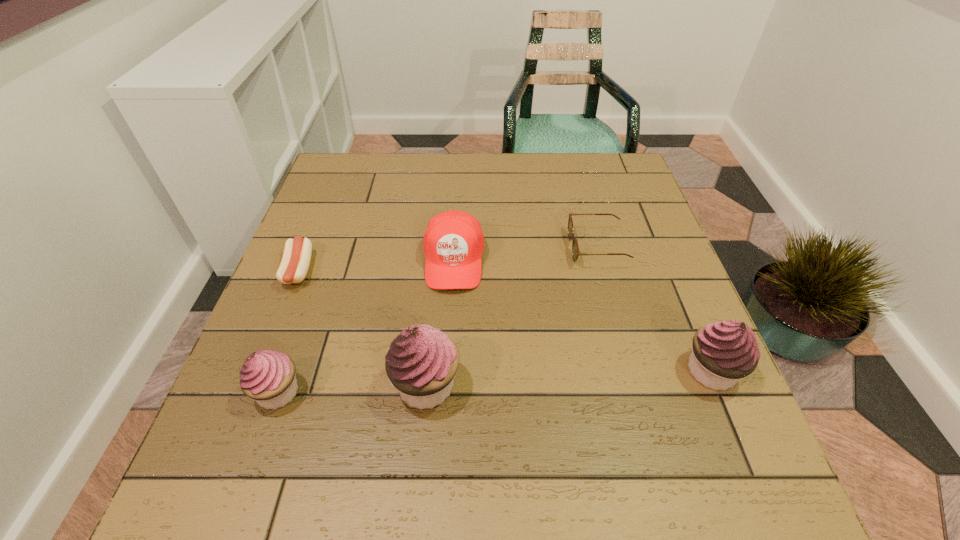
You are a GUI agent. You are given a task and a screenshot of the screen. Output one action in this format:
    pyautogui.click(x=<x>, y=<y>)
    Task: Click on the cupcake identified as the second closest to the second shortest cupcake
    
    Given the screenshot: What is the action you would take?
    pyautogui.click(x=268, y=376)

Find the location of a particular element. The height and width of the screenshot is (540, 960). free region that satisfies the following two spatial constraints: 1. at the front view of the rightmost object; 2. on the right side of the fifth object from left to right is located at coordinates (631, 371).

I want to click on free space in the image that satisfies the following two spatial constraints: 1. on the front side of the leftmost cupcake; 2. on the right side of the sausage, so click(x=249, y=392).

I want to click on vacant region that satisfies the following two spatial constraints: 1. at the front view of the fifth object from left to right; 2. on the front side of the leftmost cupcake, so click(636, 392).

Image resolution: width=960 pixels, height=540 pixels. In order to click on vacant region that satisfies the following two spatial constraints: 1. on the front panel of the fourth tallest object; 2. on the right side of the second tallest object in this screenshot , I will do `click(447, 371)`.

Find the location of `blank area in the image that satisfies the following two spatial constraints: 1. on the front panel of the baseball cap; 2. on the left side of the second tallest cupcake`. blank area in the image that satisfies the following two spatial constraints: 1. on the front panel of the baseball cap; 2. on the left side of the second tallest cupcake is located at coordinates (447, 371).